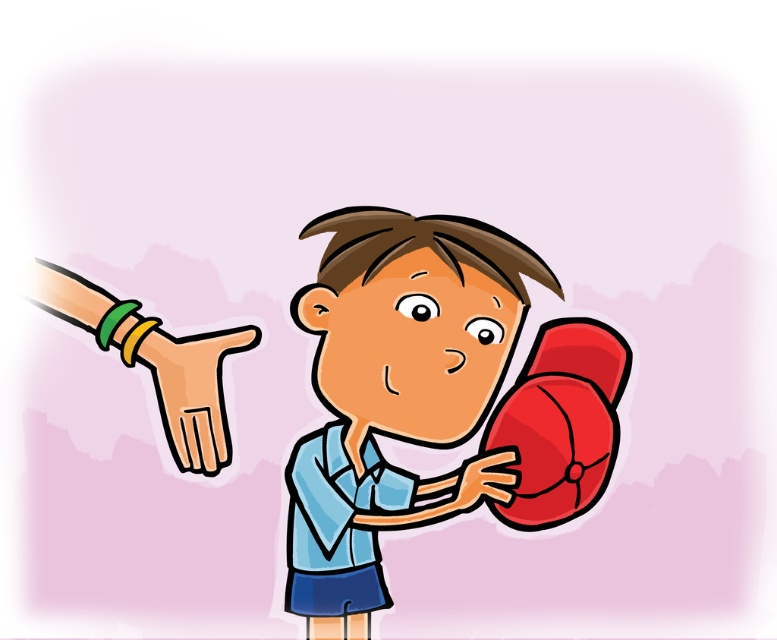
Question: Which point is farther from the camera taking this photo?

Choices:
 (A) (300, 548)
 (B) (460, 496)
 (C) (572, 385)

Answer: (C)

Question: Considering the relative positions of shiny red boxing glove at right and red matte boxing glove at left in the image provided, where is shiny red boxing glove at right located with respect to red matte boxing glove at left?

Choices:
 (A) above
 (B) below

Answer: (B)

Question: Is shiny red boxing glove at right bigger than red matte boxing glove at left?

Choices:
 (A) yes
 (B) no

Answer: (B)

Question: Which point is farther to the camera?

Choices:
 (A) (563, 486)
 (B) (96, 316)
 (C) (478, 458)

Answer: (C)

Question: Which of the following is the farthest from the observer?

Choices:
 (A) (211, 448)
 (B) (469, 504)
 (C) (199, 460)
 (D) (395, 305)

Answer: (D)

Question: Is shiny red boxing glove at right wider than smooth beige hand at left?

Choices:
 (A) no
 (B) yes

Answer: (B)